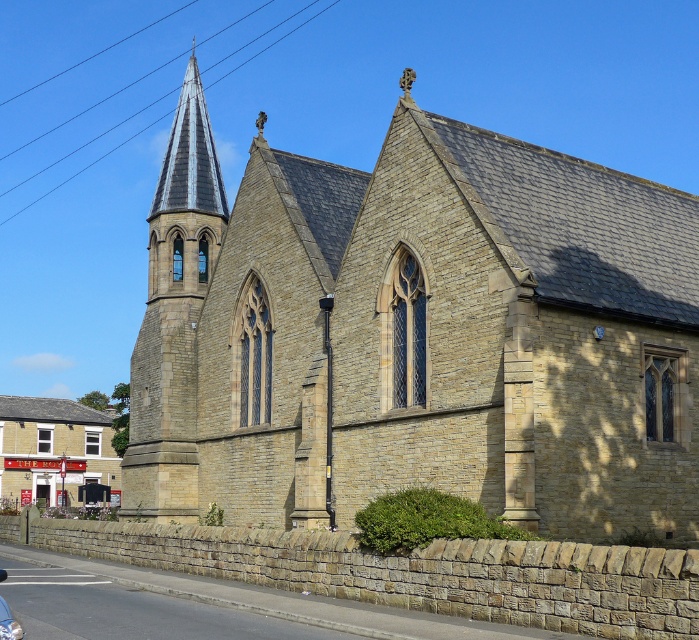
You are an architect evaluating the spatial compatibility of a new sculpture. The sculpture is 10 meters tall and needs to be placed near the stone church at center and the gray slate spire at upper left. Considering their sizes, which structure should the sculpture be placed closer to for visual balance?

The stone church at center is smaller than the gray slate spire at upper left. To achieve visual balance, the sculpture should be placed closer to the stone church at center since it is smaller, preventing it from being overwhelmed by the larger spire.

You are standing in front of the church and notice two points marked on the building. Which point, point (145, 492) or point (161, 257), is closer to you?

Point (145, 492) is closer to the viewer than point (161, 257).

Based on the photo, you are standing in the parking lot of a church and see the stone church at center and the shiny silver car at lower left. Which object is closer to the parking lot entrance?

The shiny silver car at lower left is closer to the parking lot entrance because it is positioned on the left side of the stone church at center.